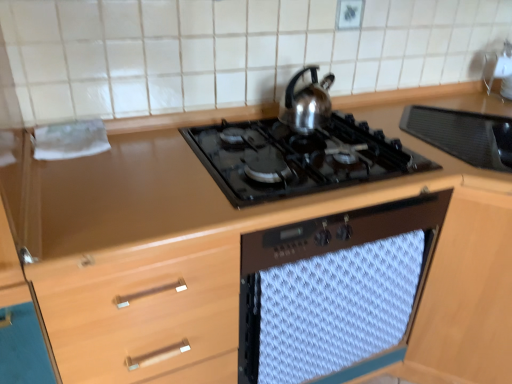
Find the location of `vacant region to the left of satin silver kettle at upper center`. vacant region to the left of satin silver kettle at upper center is located at coordinates (254, 132).